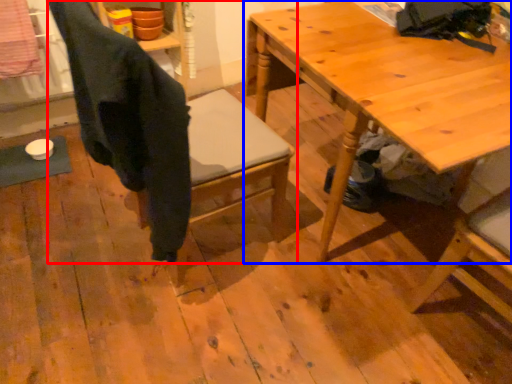
Question: Among these objects, which one is nearest to the camera, chair (highlighted by a red box) or table (highlighted by a blue box)?

Choices:
 (A) chair
 (B) table

Answer: (A)